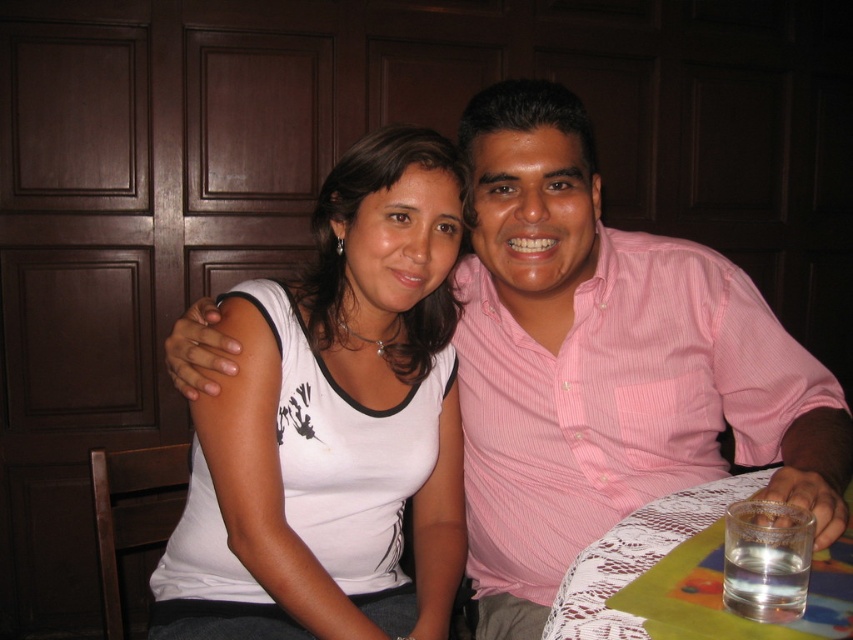
Question: Estimate the real-world distances between objects in this image. Which object is closer to the lace fabric tablecloth at lower right?

Choices:
 (A) white matte tank top at center
 (B) pink striped shirt at center

Answer: (B)

Question: Which of the following is the farthest from the observer?

Choices:
 (A) (621, 534)
 (B) (525, 368)
 (C) (486, 333)
 (D) (398, 337)

Answer: (C)

Question: Where is pink striped shirt at center located in relation to white matte tank top at center in the image?

Choices:
 (A) above
 (B) below

Answer: (A)

Question: Does pink striped shirt at center have a larger size compared to pink striped shirt at right?

Choices:
 (A) no
 (B) yes

Answer: (B)

Question: Which point is closer to the camera?

Choices:
 (A) (422, 369)
 (B) (782, 380)
 (C) (712, 320)

Answer: (B)

Question: Is pink striped shirt at center below lace fabric tablecloth at lower right?

Choices:
 (A) no
 (B) yes

Answer: (A)